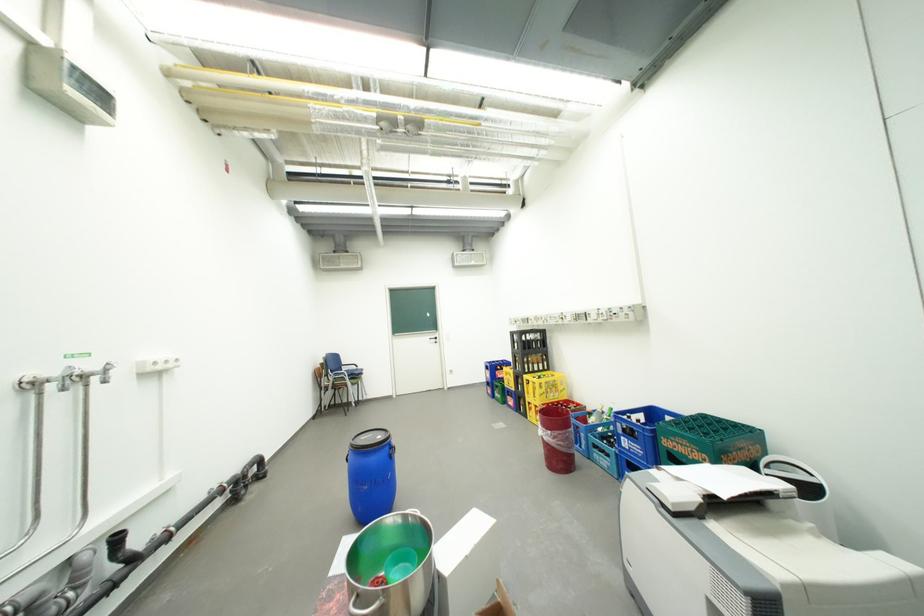
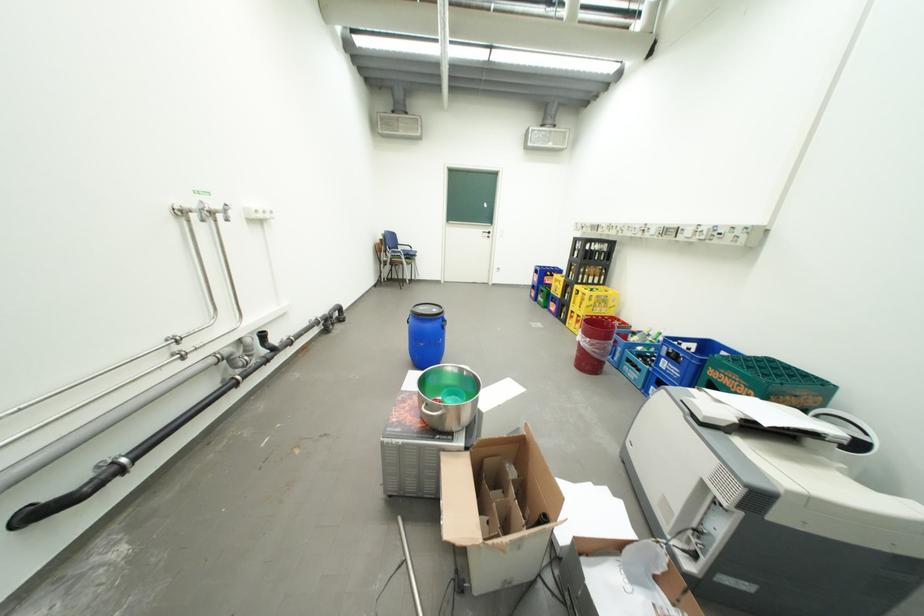
In the second image, find the point that corresponds to point (633, 439) in the first image.

(674, 361)